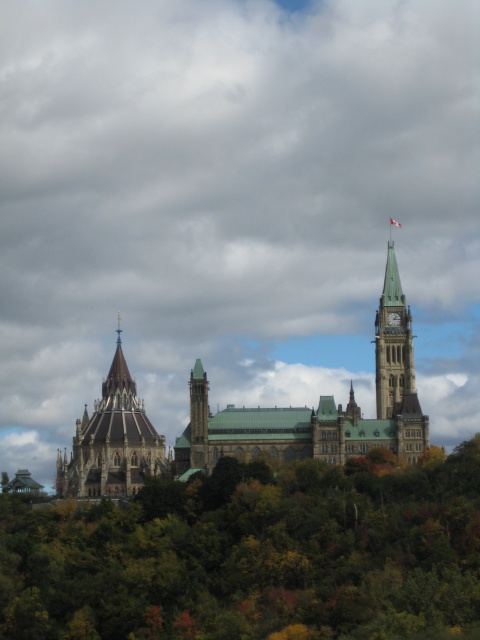
Based on the scene description, where are the green leafy trees at center located in the image?

The green leafy trees at center are located at point (253, 556).